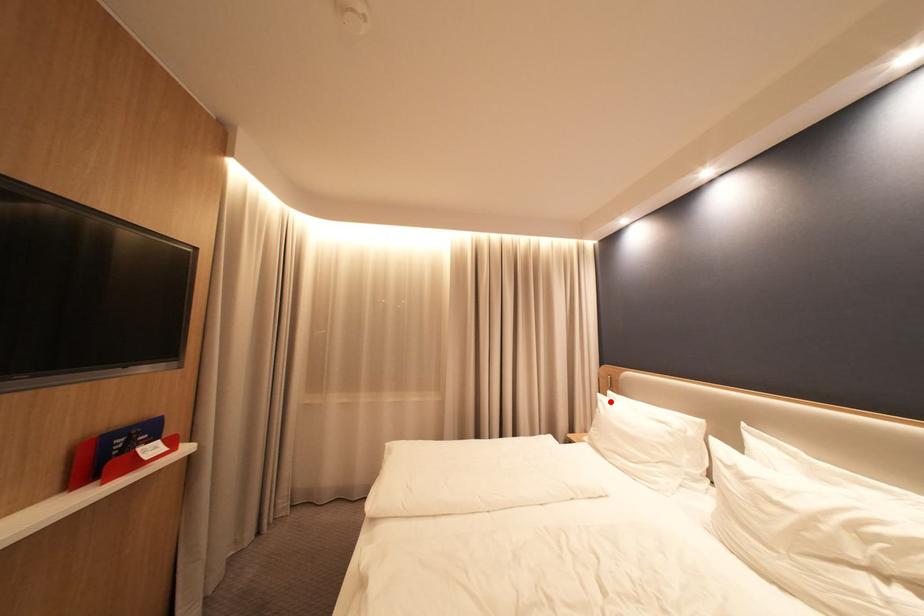
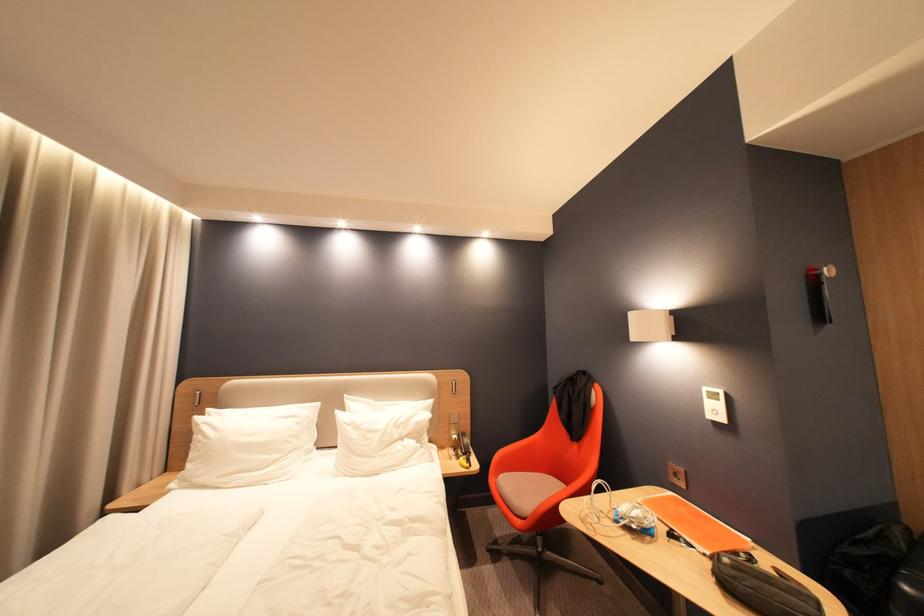
Find the pixel in the second image that matches the highlighted location in the first image.

(213, 424)